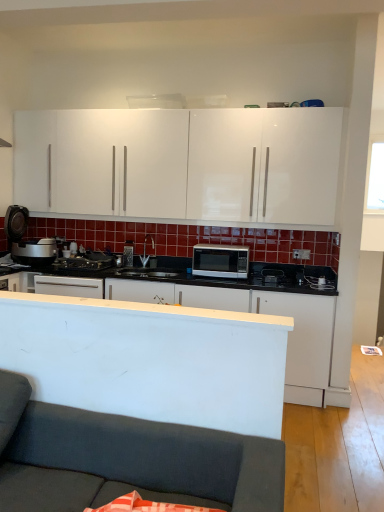
Question: Considering the positions of point (210, 257) and point (117, 477), is point (210, 257) closer or farther from the camera than point (117, 477)?

Choices:
 (A) closer
 (B) farther

Answer: (B)

Question: Considering the positions of satin silver microwave at center and dark gray fabric couch at lower left in the image, is satin silver microwave at center bigger or smaller than dark gray fabric couch at lower left?

Choices:
 (A) big
 (B) small

Answer: (B)

Question: Estimate the real-world distances between objects in this image. Which object is farther from the white matte microwave at center, the second cabinetry from the top?

Choices:
 (A) satin silver microwave at center
 (B) transparent glass window at upper right
 (C) white glossy cabinets at upper center, acting as the 2th cabinetry starting from the bottom
 (D) dark gray fabric couch at lower left

Answer: (D)

Question: Which is farther from the transparent glass window at upper right?

Choices:
 (A) white matte microwave at center, the second cabinetry from the top
 (B) satin silver microwave at center
 (C) dark gray fabric couch at lower left
 (D) white glossy cabinets at upper center, acting as the 1th cabinetry starting from the top

Answer: (C)